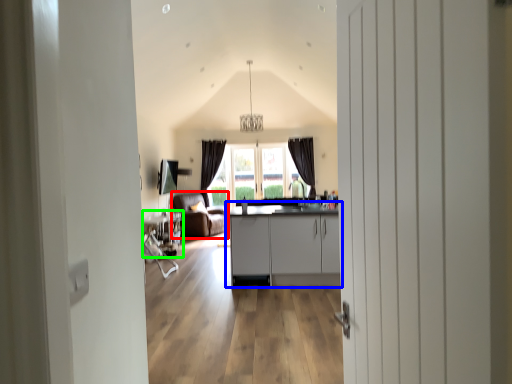
Question: Estimate the real-world distances between objects in this image. Which object is farther from armchair (highlighted by a red box), cabinetry (highlighted by a blue box) or table (highlighted by a green box)?

Choices:
 (A) cabinetry
 (B) table

Answer: (A)